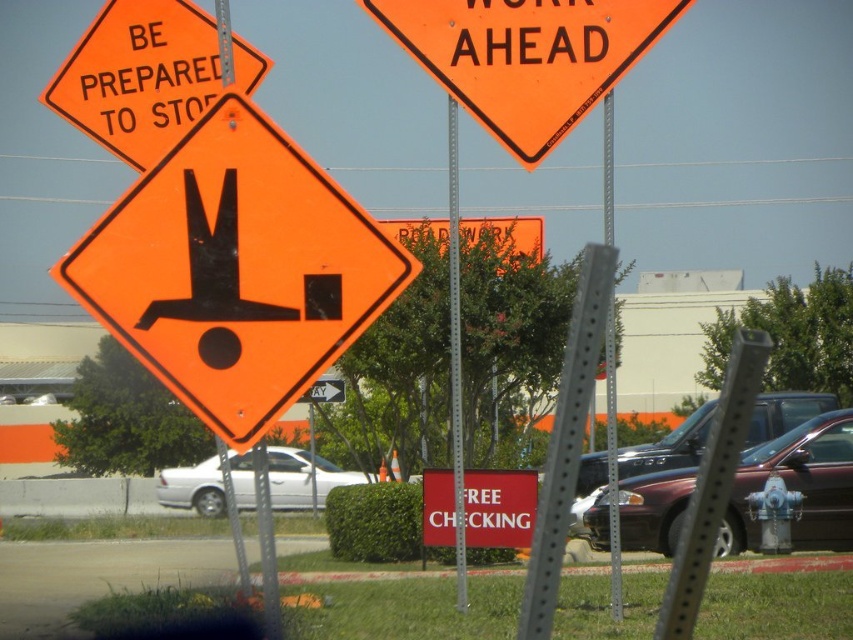
You are a driver approaching the road signs and need to know the exact location of the orange reflective diamond at center. What are its coordinates?

The orange reflective diamond at center is located at point (x=235, y=269).

You are driving and see two signs ahead. The orange reflective diamond at center and the red matte sign at center. Which one is more to the left?

The orange reflective diamond at center is more to the left than the red matte sign at center.

From the picture: You are a delivery driver approaching an intersection with these road signs. You need to know which object is narrower to plan your route. Which is thinner between the orange reflective plastic sign at upper center and the metallic silver pole at center?

The orange reflective plastic sign at upper center is thinner than the metallic silver pole at center, so it is narrower.